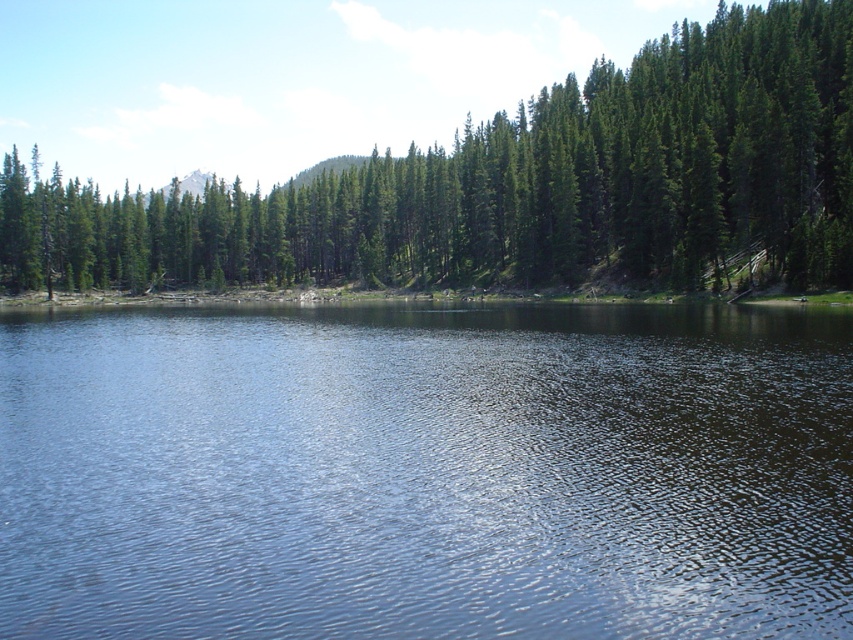
Question: Does clear water at center have a greater width compared to green matte tree at upper center?

Choices:
 (A) no
 (B) yes

Answer: (A)

Question: Can you confirm if clear water at center is bigger than green matte tree at upper center?

Choices:
 (A) yes
 (B) no

Answer: (B)

Question: Which object appears farthest from the camera in this image?

Choices:
 (A) green matte tree at upper center
 (B) clear water at center

Answer: (A)

Question: From the image, what is the correct spatial relationship of clear water at center in relation to green matte tree at upper center?

Choices:
 (A) above
 (B) below

Answer: (B)